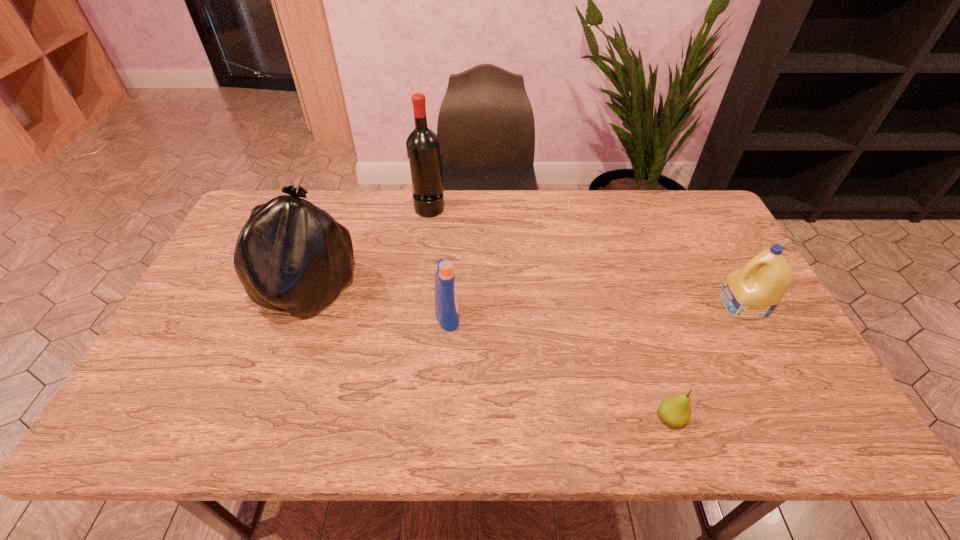
What are the coordinates of `the tallest object` in the screenshot? It's located at click(423, 146).

Where is `the farthest object`? the farthest object is located at coordinates [x=423, y=146].

Identify the location of plastic bag. This screenshot has height=540, width=960. (291, 255).

Locate an element on the screen. This screenshot has width=960, height=540. the second tallest object is located at coordinates (291, 255).

Where is `the third object from right to left`? The image size is (960, 540). the third object from right to left is located at coordinates (446, 303).

Where is `the right detergent`? the right detergent is located at coordinates (752, 292).

Where is `pear`? This screenshot has height=540, width=960. pear is located at coordinates pos(676,411).

Locate an element on the screen. This screenshot has width=960, height=540. the nearest object is located at coordinates (676, 411).

Identify the location of free space located on the right of the farthest object. This screenshot has height=540, width=960. (561, 207).

This screenshot has width=960, height=540. What are the coordinates of `free location located 0.180m on the right of the second tallest object` in the screenshot? It's located at (419, 292).